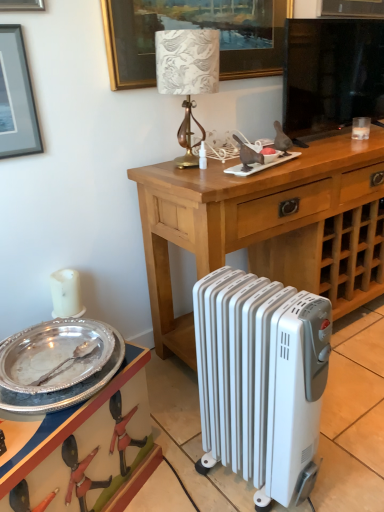
Identify the location of free space above white metallic radiator at lower center (from a real-world perspective). This screenshot has width=384, height=512. (265, 292).